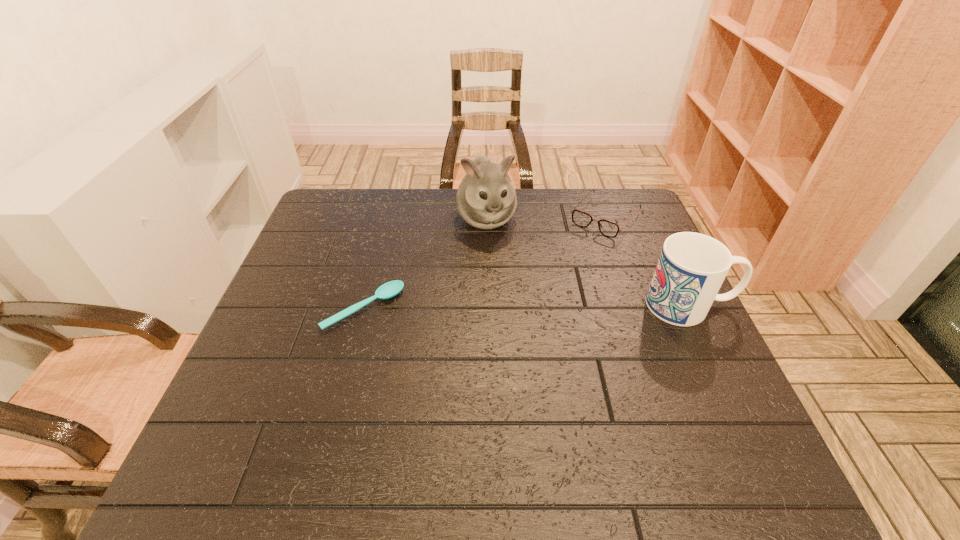
I want to click on free space at the far edge of the desktop, so click(563, 195).

In the image, there is a desktop. What are the coordinates of `vacant space at the near edge` in the screenshot? It's located at (455, 418).

Where is `vacant space at the left edge of the desktop`? vacant space at the left edge of the desktop is located at coordinates (295, 286).

Identify the location of vacant space at the right edge. (656, 318).

You are a GUI agent. You are given a task and a screenshot of the screen. Output one action in this format:
    pyautogui.click(x=<x>, y=<y>)
    Task: Click on the vacant region at the far right corner
    The height and width of the screenshot is (540, 960).
    Given the screenshot: What is the action you would take?
    coord(633,188)

Where is `blank space at the near right corner`? blank space at the near right corner is located at coordinates (674, 427).

What are the coordinates of `free space between the tallest object and the mug` in the screenshot? It's located at (588, 261).

What are the coordinates of `free area in between the spoon and the tallest object` in the screenshot? It's located at (425, 264).

Identify the location of free area in between the leftmost object and the mug. (527, 307).

At what (x,y) coordinates should I click in order to perform the action: click on unoccupied position between the sunglasses and the shortest object. Please return your answer as a coordinate pair (x, y). Looking at the image, I should click on (485, 263).